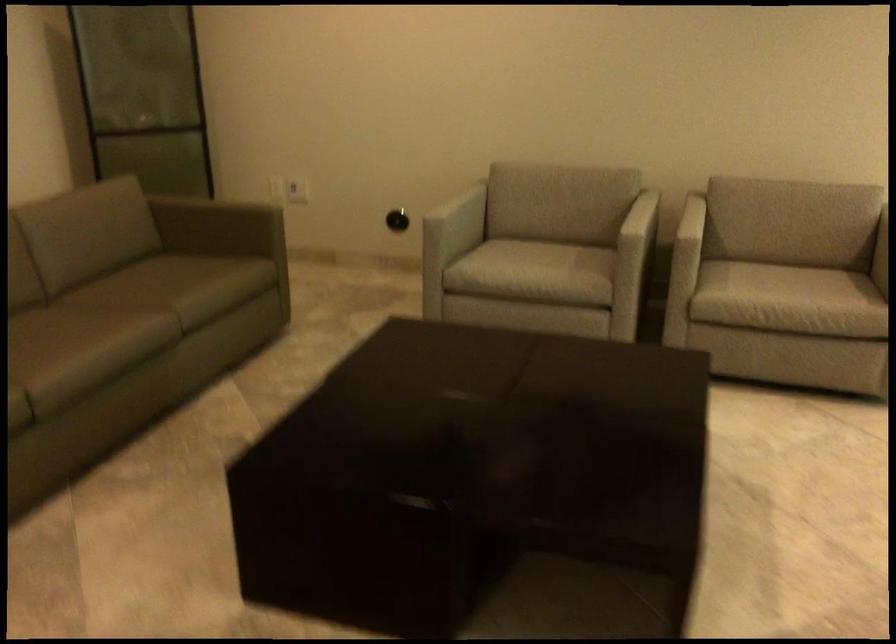
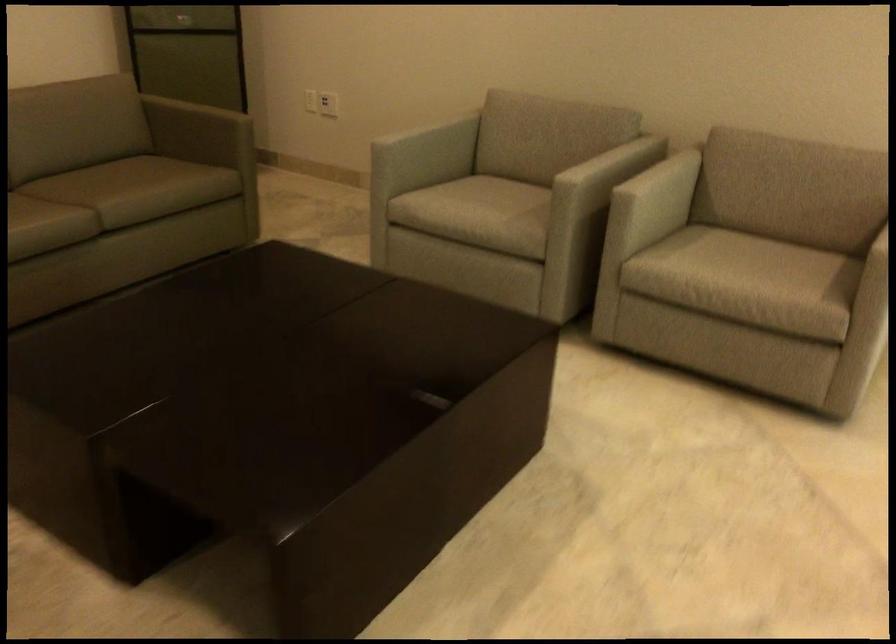
Find the pixel in the second image that matches the point at 765,275 in the first image.

(739, 257)